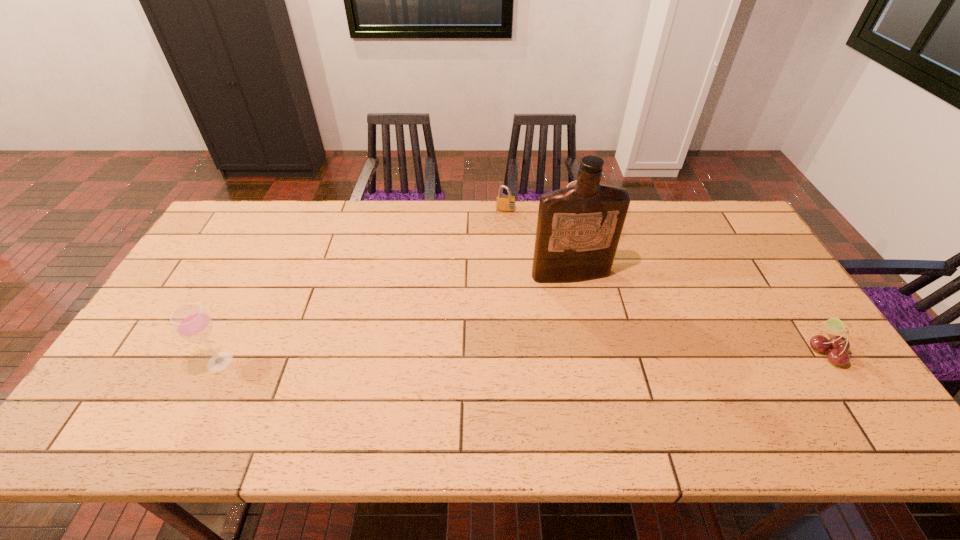
Locate an element on the screen. empty location between the rightmost object and the third nearest object is located at coordinates (698, 313).

This screenshot has height=540, width=960. Find the location of `free spot between the mug and the rightmost object`. free spot between the mug and the rightmost object is located at coordinates (703, 284).

Choose which object is the third nearest neighbor to the rightmost object. Please provide its 2D coordinates. Your answer should be formatted as a tuple, i.e. [(x, y)], where the tuple contains the x and y coordinates of a point satisfying the conditions above.

[(506, 203)]

You are a GUI agent. You are given a task and a screenshot of the screen. Output one action in this format:
    pyautogui.click(x=<x>, y=<y>)
    Task: Click on the closest object to the padlock
    The width and height of the screenshot is (960, 540).
    Given the screenshot: What is the action you would take?
    pyautogui.click(x=572, y=183)

Find the location of `free region that satisfies the following two spatial constraints: 1. on the back side of the cherry; 2. on the leaves of the leftmost object`. free region that satisfies the following two spatial constraints: 1. on the back side of the cherry; 2. on the leaves of the leftmost object is located at coordinates (226, 351).

You are a GUI agent. You are given a task and a screenshot of the screen. Output one action in this format:
    pyautogui.click(x=<x>, y=<y>)
    Task: Click on the vacant space that satisfies the following two spatial constraints: 1. on the front side of the padlock; 2. on the leaves of the rightmost object
    This screenshot has height=540, width=960.
    Given the screenshot: What is the action you would take?
    tap(516, 351)

Locate an element on the screen. The height and width of the screenshot is (540, 960). free location that satisfies the following two spatial constraints: 1. on the front side of the second object from left to right; 2. on the right side of the liquor is located at coordinates (510, 274).

The width and height of the screenshot is (960, 540). Identify the location of free location that satisfies the following two spatial constraints: 1. on the front side of the mug; 2. on the leaves of the rightmost object. (615, 351).

The image size is (960, 540). I want to click on vacant space that satisfies the following two spatial constraints: 1. on the back side of the mug; 2. on the right side of the fourth shortest object, so click(292, 216).